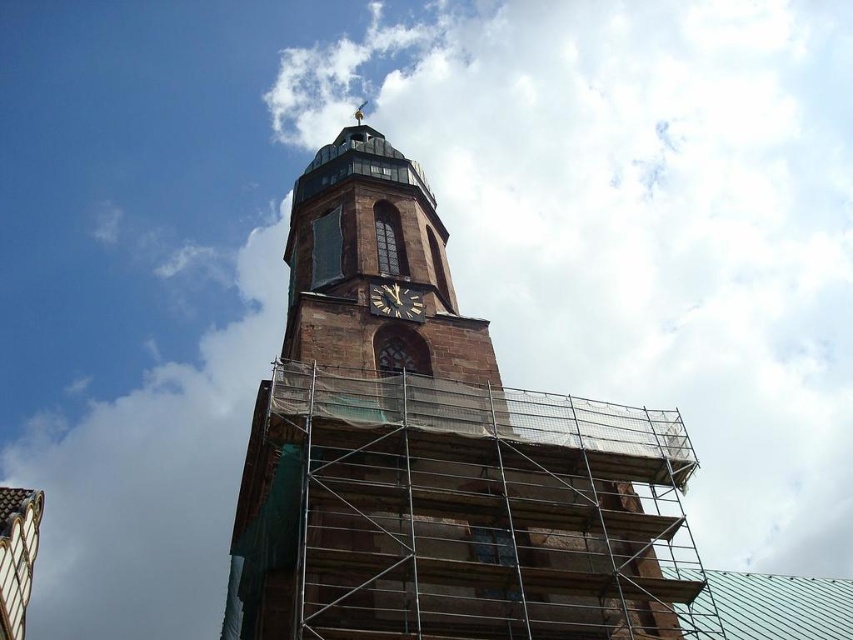
Question: Can you confirm if brown stone church at center is positioned to the left of black polished wood clock at center?

Choices:
 (A) yes
 (B) no

Answer: (A)

Question: Which object is positioned closest to the brown stone church at center?

Choices:
 (A) brown stone clock tower at center
 (B) black polished wood clock at center

Answer: (A)

Question: Is brown stone church at center further to camera compared to black polished wood clock at center?

Choices:
 (A) no
 (B) yes

Answer: (A)

Question: Which object appears closest to the camera in this image?

Choices:
 (A) brown stone clock tower at center
 (B) black polished wood clock at center
 (C) brown stone church at center

Answer: (C)

Question: Can you confirm if brown stone church at center is thinner than brown stone clock tower at center?

Choices:
 (A) no
 (B) yes

Answer: (A)

Question: Which object appears farthest from the camera in this image?

Choices:
 (A) black polished wood clock at center
 (B) brown stone church at center
 (C) brown stone clock tower at center

Answer: (A)